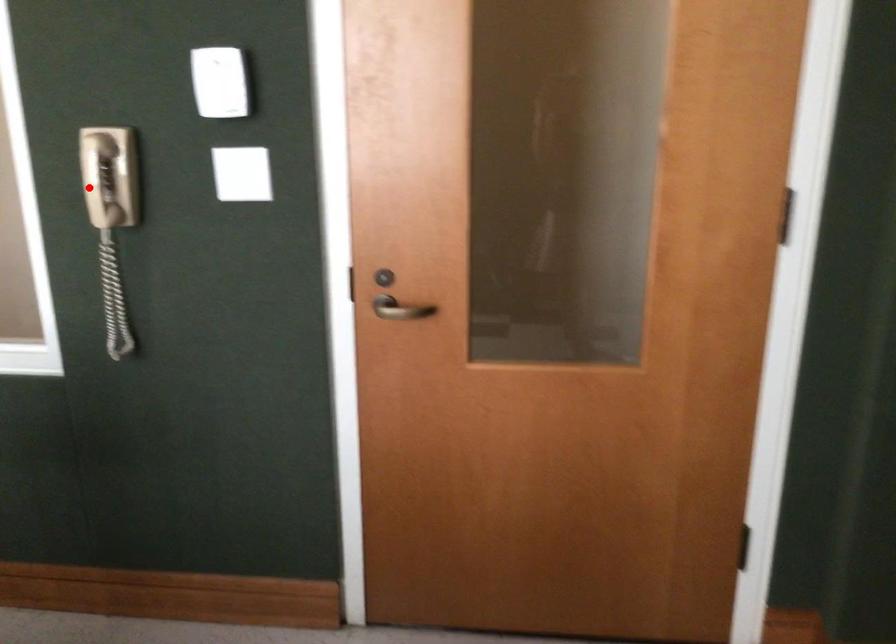
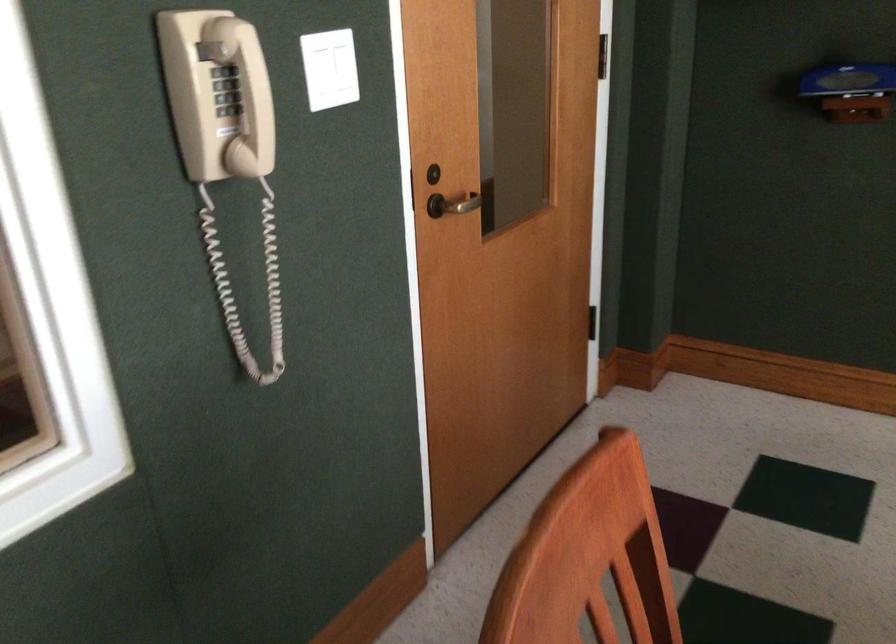
The point at the highlighted location is marked in the first image. Where is the corresponding point in the second image?

(245, 95)